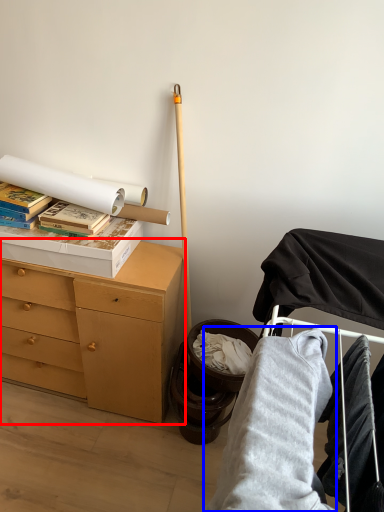
Question: Among these objects, which one is nearest to the camera, chest of drawers (highlighted by a red box) or clothing (highlighted by a blue box)?

Choices:
 (A) chest of drawers
 (B) clothing

Answer: (B)